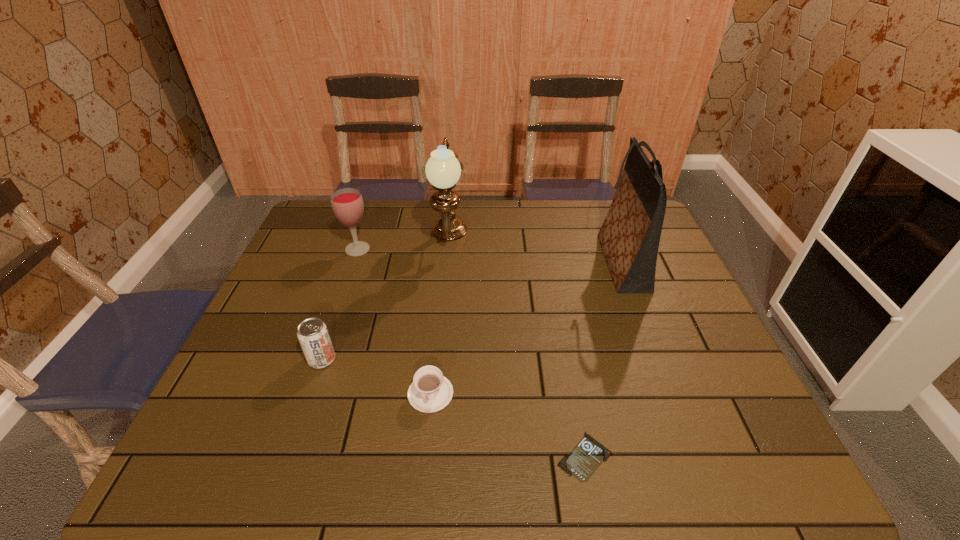
In order to click on free spot that satisfies the following two spatial constraints: 1. on the handle side of the teacup; 2. on the left side of the identity card in this screenshot , I will do `click(424, 456)`.

The height and width of the screenshot is (540, 960). I want to click on free spot that satisfies the following two spatial constraints: 1. on the handle side of the second nearest object; 2. on the left side of the shortest object, so click(x=424, y=456).

In order to click on vacant region that satisfies the following two spatial constraints: 1. on the handle side of the identity card; 2. on the right side of the fifth farthest object in this screenshot , I will do `click(424, 456)`.